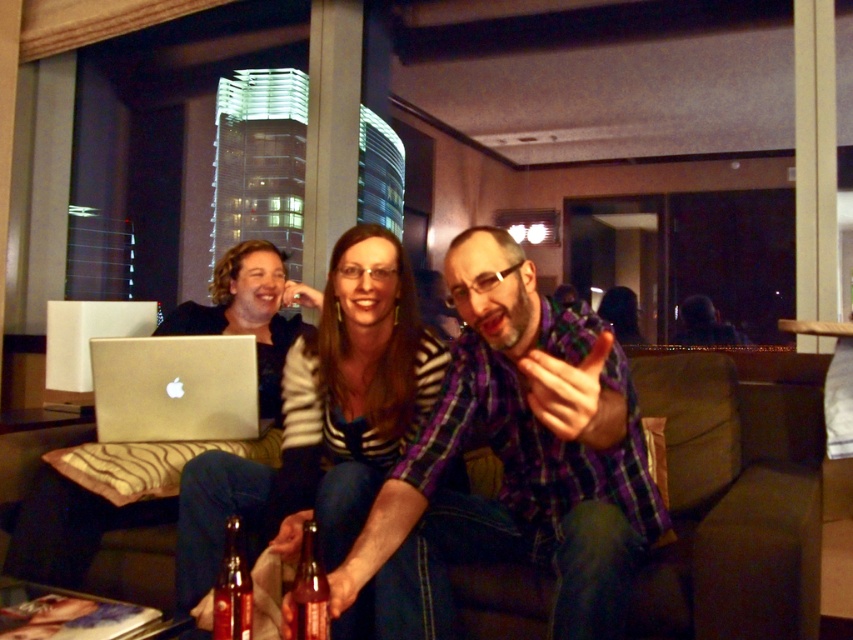
Where is the purple plaid shirt at center located in the image?

The purple plaid shirt at center is located at point (515, 461) in the image.

From the picture: You are a photographer setting up a shot of the scene. You need to ensure that the purple plaid shirt at center and the gold metallic laptop at center are both in focus. Which object should you adjust your camera focus to prioritize first to ensure both are in focus?

The purple plaid shirt at center is taller than the gold metallic laptop at center. To ensure both are in focus, prioritize focusing on the taller object first, which is the purple plaid shirt at center, as it occupies more vertical space and may require adjustment to capture its full height while still keeping the laptop in focus.